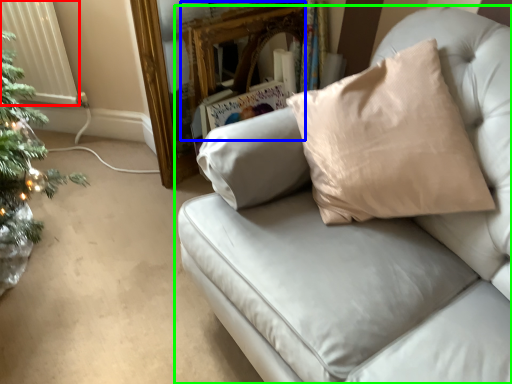
Question: Which is farther away from radiator (highlighted by a red box)? mirror (highlighted by a blue box) or studio couch (highlighted by a green box)?

Choices:
 (A) mirror
 (B) studio couch

Answer: (B)